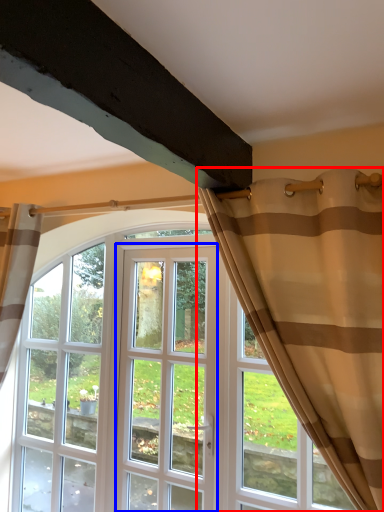
Question: Which object appears closest to the camera in this image, curtain (highlighted by a red box) or screen door (highlighted by a blue box)?

Choices:
 (A) curtain
 (B) screen door

Answer: (A)